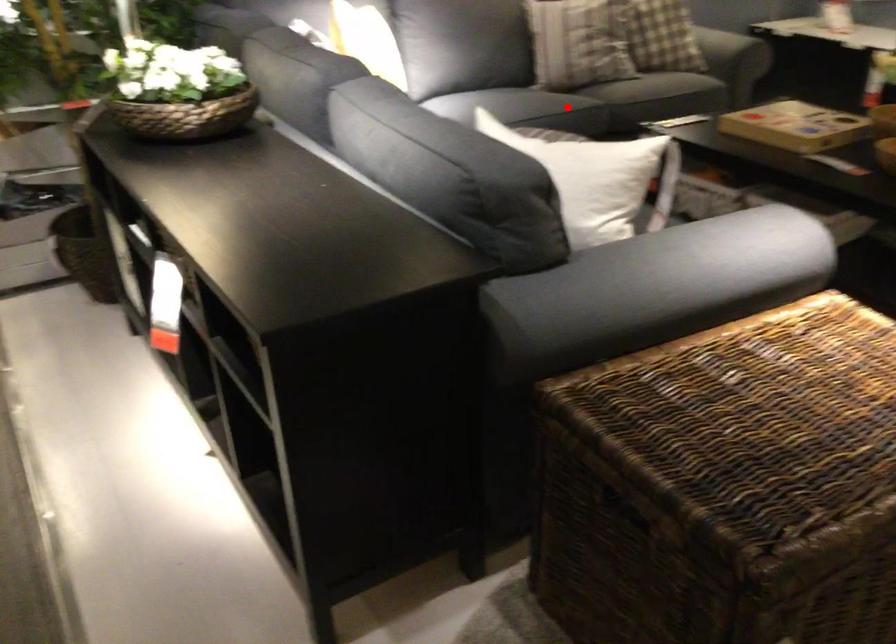
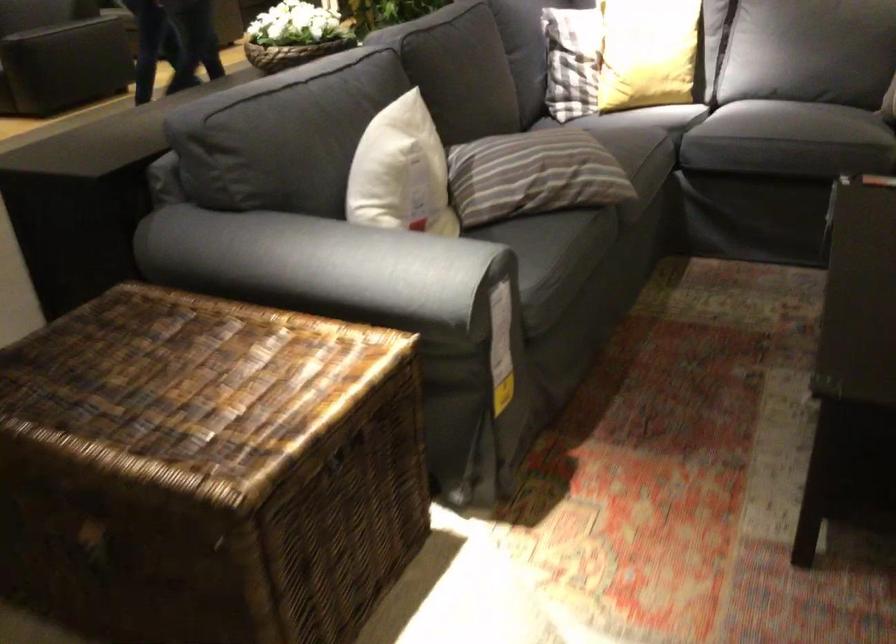
Question: I am providing you with two images of the same scene from different viewpoints. Image1 has a red point marked. In image2, the corresponding 3D location appears at what relative position? Reply with the corresponding letter.

Choices:
 (A) Closer
 (B) Farther

Answer: (A)